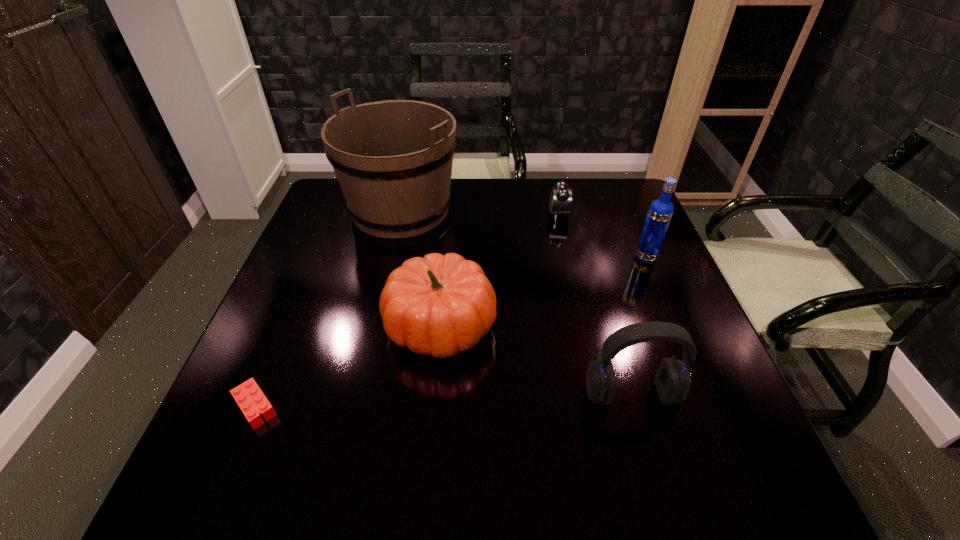
Find the location of a particular element. the tallest object is located at coordinates (393, 159).

You are a GUI agent. You are given a task and a screenshot of the screen. Output one action in this format:
    pyautogui.click(x=<x>, y=<y>)
    Task: Click on the vodka
    
    Given the screenshot: What is the action you would take?
    pyautogui.click(x=660, y=212)

Identify the location of the third farthest object. [660, 212].

Find the location of a particular element. The image size is (960, 540). headset is located at coordinates (672, 380).

The image size is (960, 540). Identify the location of the third shortest object. (440, 305).

Identify the location of pumpkin. This screenshot has width=960, height=540. (440, 305).

You are a GUI agent. You are given a task and a screenshot of the screen. Output one action in this format:
    pyautogui.click(x=<x>, y=<y>)
    Task: Click on the alarm clock
    
    Given the screenshot: What is the action you would take?
    pyautogui.click(x=561, y=195)

The width and height of the screenshot is (960, 540). In order to click on Lego in this screenshot , I will do `click(249, 397)`.

The height and width of the screenshot is (540, 960). Identify the location of vacant point located 0.180m on the front of the bucket. (382, 294).

Find the location of `vacant space situated on the left of the second tallest object`. vacant space situated on the left of the second tallest object is located at coordinates (587, 257).